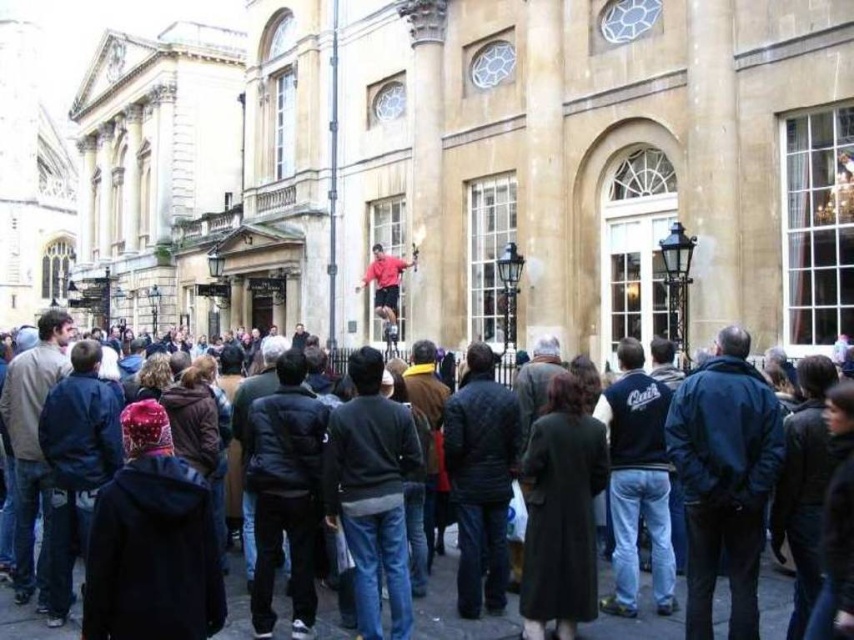
Does red jacket at center have a smaller size compared to matte red shirt at center?

Incorrect, red jacket at center is not smaller in size than matte red shirt at center.

Is point (583, 636) positioned after point (396, 272)?

No, (583, 636) is in front of (396, 272).

What are the coordinates of `red jacket at center` in the screenshot? It's located at (454, 605).